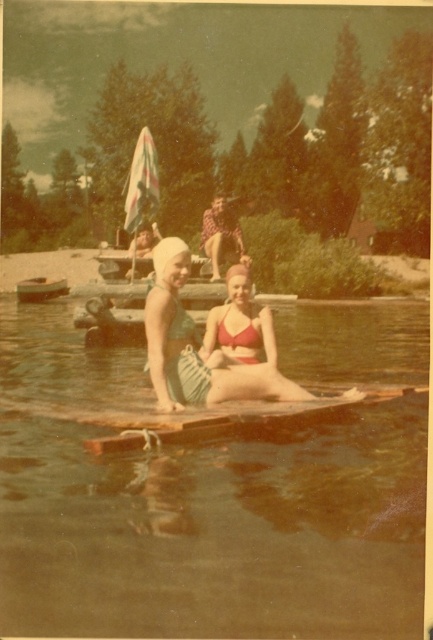
Question: Does clear water at center have a greater width compared to green striped swimsuit at center?

Choices:
 (A) yes
 (B) no

Answer: (A)

Question: Which object is the closest to the clear water at center?

Choices:
 (A) matte red bikini at center
 (B) green striped swimsuit at center
 (C) wooden boat at lower left

Answer: (A)

Question: Where is clear water at center located in relation to matte red bikini at center in the image?

Choices:
 (A) below
 (B) above

Answer: (A)

Question: Which of the following is the closest to the observer?

Choices:
 (A) matte green swimsuit at center
 (B) matte red bikini at center

Answer: (B)

Question: Which point appears farthest from the camera in this image?

Choices:
 (A) (x=177, y=240)
 (B) (x=222, y=353)
 (C) (x=161, y=497)

Answer: (B)

Question: Can you confirm if matte green swimsuit at center is positioned below wooden boat at lower left?

Choices:
 (A) no
 (B) yes

Answer: (B)